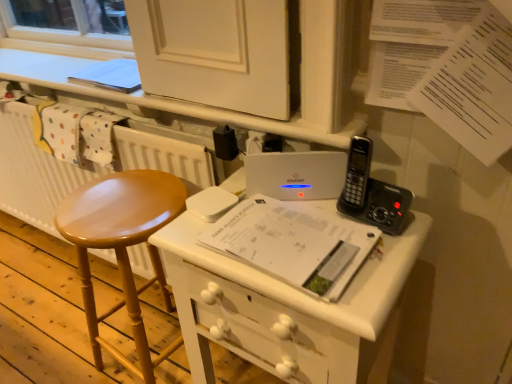
The height and width of the screenshot is (384, 512). I want to click on free area in between shiny wood stool at left and white matte radiator at left, so click(52, 287).